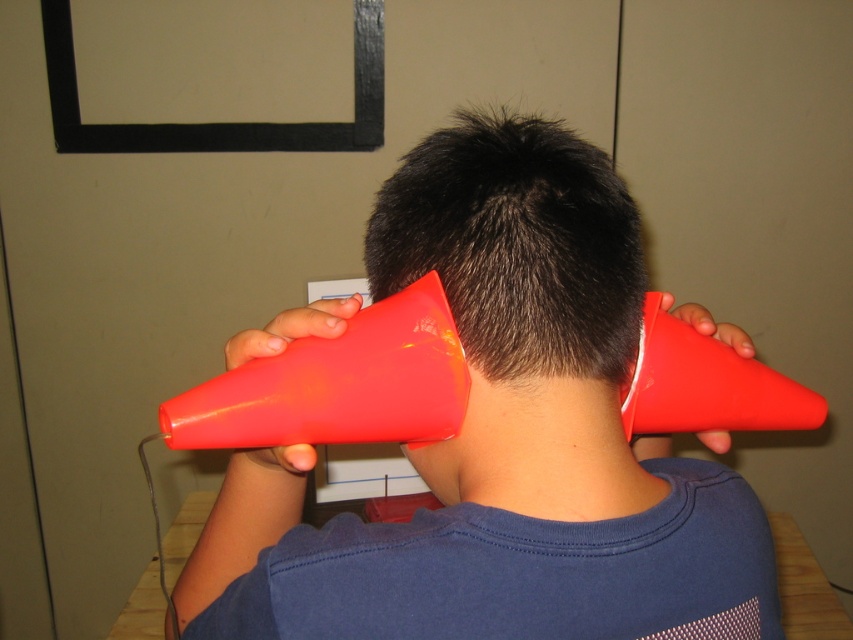
You are standing in a room and see a point marked at coordinates (611, 236). You need to place a 50 cm wide poster on the wall so that it covers this point exactly at its center. Is the distance from the camera to this point sufficient for the poster to fit without overlapping the edges?

The point at coordinates (611, 236) is 52.89 centimeters from the camera. Since the poster is 50 cm wide, the distance is sufficient as 52.89 cm is greater than 50 cm, allowing the poster to fit without overlapping the edges.

You are standing in the room and want to move from the point at coordinates point (x=223, y=577) to the point at coordinates point (x=410, y=212). Which direction should you face to walk towards the second point?

To move from point (x=223, y=577) to point (x=410, y=212), you should face towards the left and forward direction since point (x=223, y=577) is behind point (x=410, y=212).